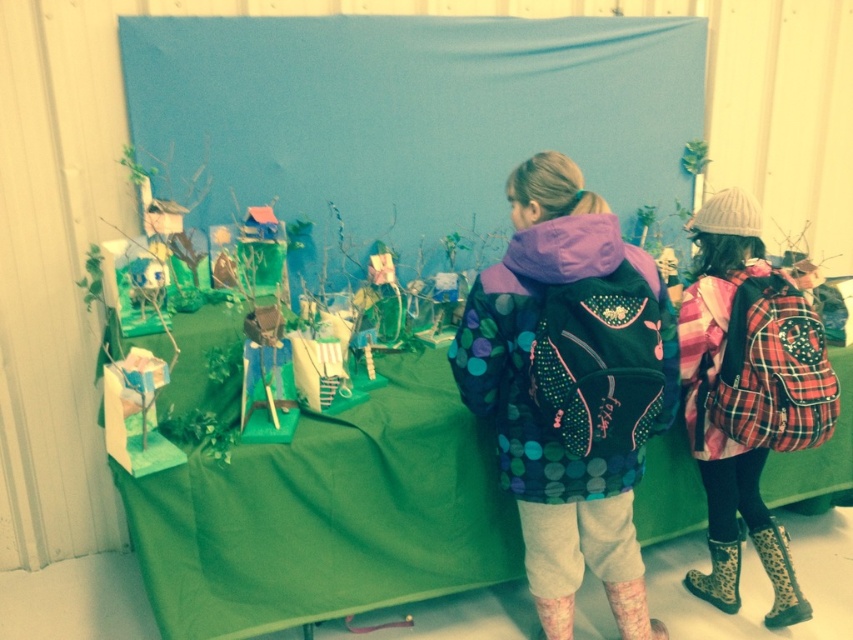
Is point (425, 376) farther from camera compared to point (718, 568)?

That is False.

Can you confirm if green fabric table at center is positioned above leopard print rubber boot at lower right?

Yes, green fabric table at center is above leopard print rubber boot at lower right.

Describe the element at coordinates (328, 515) in the screenshot. I see `green fabric table at center` at that location.

Identify the location of green fabric table at center. This screenshot has height=640, width=853. (328, 515).

Is point (276, 509) more distant than point (622, 600)?

No, (276, 509) is closer to viewer.

From the picture: Is green fabric table at center below pink textured boot at lower right?

Actually, green fabric table at center is above pink textured boot at lower right.

The width and height of the screenshot is (853, 640). Describe the element at coordinates (328, 515) in the screenshot. I see `green fabric table at center` at that location.

What are the coordinates of `green fabric table at center` in the screenshot? It's located at (328, 515).

Can you confirm if plaid fabric backpack at right is thinner than leopard print rubber boot at lower right?

No.

Between plaid fabric backpack at right and leopard print rubber boot at lower right, which one is positioned higher?

plaid fabric backpack at right is higher up.

Is point (782, 390) more distant than point (686, 580)?

No, (782, 390) is in front of (686, 580).

The width and height of the screenshot is (853, 640). I want to click on plaid fabric backpack at right, so click(741, 397).